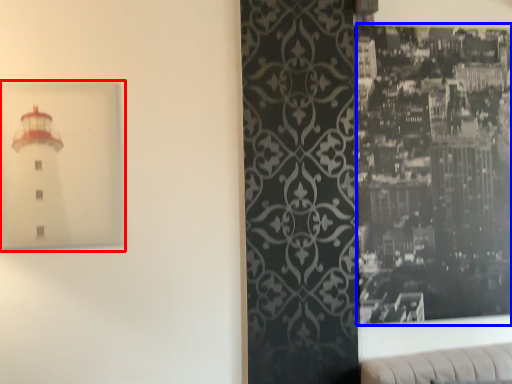
Question: Which object is closer to the camera taking this photo, picture frame (highlighted by a red box) or picture frame (highlighted by a blue box)?

Choices:
 (A) picture frame
 (B) picture frame

Answer: (A)